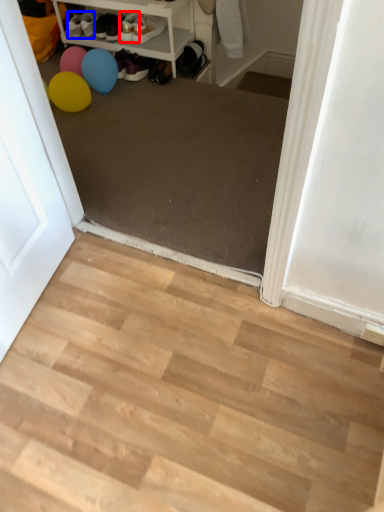
Question: Which object appears closest to the camera in this image, footwear (highlighted by a red box) or shoe (highlighted by a blue box)?

Choices:
 (A) footwear
 (B) shoe

Answer: (A)